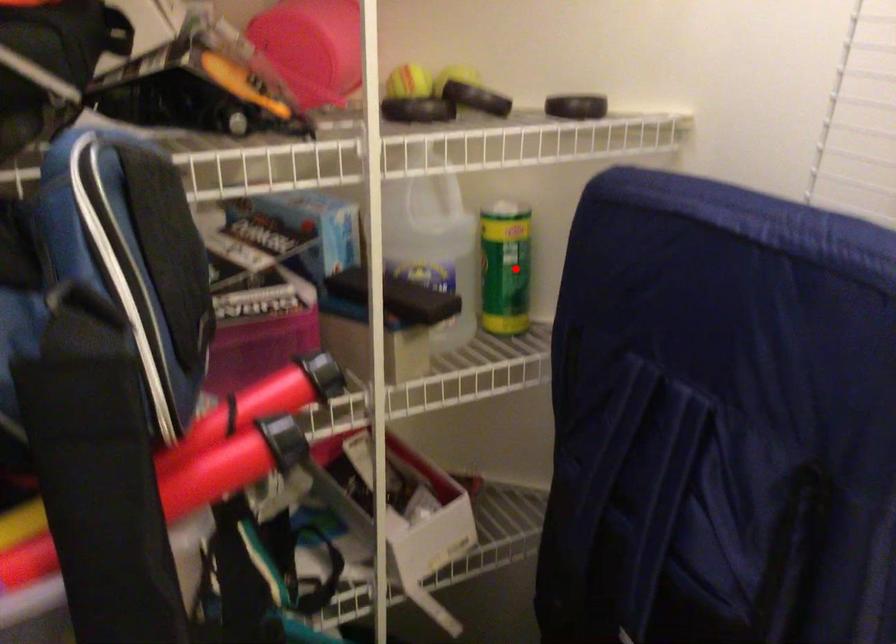
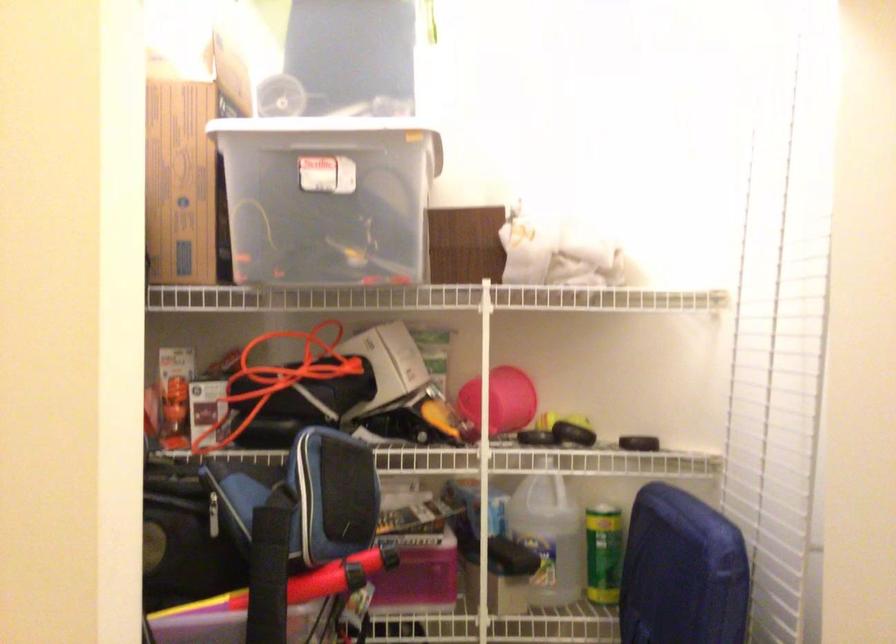
Question: I am providing you with two images of the same scene from different viewpoints. Given a red point in image1, look at the same physical point in image2. Is it:

Choices:
 (A) Closer to the viewpoint
 (B) Farther from the viewpoint

Answer: (B)